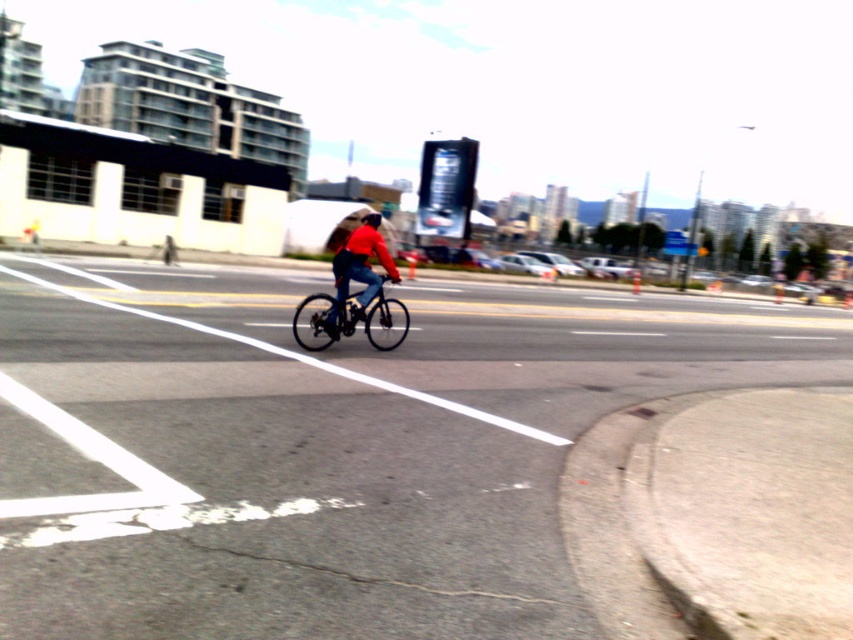
Between black rubber bike lane at center and shiny black bicycle at center, which one appears on the right side from the viewer's perspective?

Positioned to the right is black rubber bike lane at center.

Is black rubber bike lane at center to the right of shiny black bicycle at center from the viewer's perspective?

Yes, black rubber bike lane at center is to the right of shiny black bicycle at center.

Who is more distant from viewer, (300, 397) or (310, 346)?

The point (310, 346) is behind.

The height and width of the screenshot is (640, 853). Find the location of `black rubber bike lane at center`. black rubber bike lane at center is located at coordinates (318, 452).

Between black rubber bike lane at center and black matte bicycle helmet at center, which one appears on the right side from the viewer's perspective?

black rubber bike lane at center

Which is more to the left, black rubber bike lane at center or black matte bicycle helmet at center?

From the viewer's perspective, black matte bicycle helmet at center appears more on the left side.

Does point (834, 376) come behind point (373, 220)?

Yes, point (834, 376) is farther from viewer.

Where is `black rubber bike lane at center`? black rubber bike lane at center is located at coordinates (318, 452).

Does black rubber bike lane at center lie behind matte red jacket at center?

No, black rubber bike lane at center is in front of matte red jacket at center.

Locate an element on the screen. black rubber bike lane at center is located at coordinates (318, 452).

Is point (489, 346) closer to viewer compared to point (341, 259)?

No, (489, 346) is further to viewer.

This screenshot has width=853, height=640. In order to click on black rubber bike lane at center in this screenshot , I will do `click(318, 452)`.